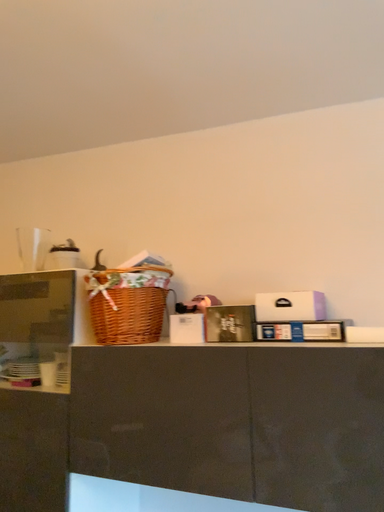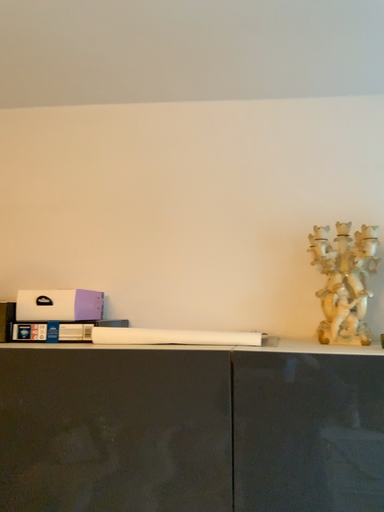
Question: How did the camera likely rotate when shooting the video?

Choices:
 (A) rotated left
 (B) rotated right

Answer: (B)